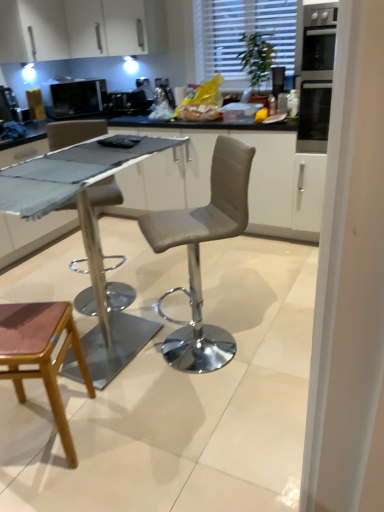
Question: From the image's perspective, would you say white textured blinds at upper center is positioned over white glossy cabinet at upper left?

Choices:
 (A) yes
 (B) no

Answer: (B)

Question: From a real-world perspective, is white textured blinds at upper center on top of white glossy cabinet at upper left?

Choices:
 (A) yes
 (B) no

Answer: (B)

Question: From a real-world perspective, is white textured blinds at upper center under white glossy cabinet at upper left?

Choices:
 (A) no
 (B) yes

Answer: (B)

Question: Could you tell me if white textured blinds at upper center is turned towards white glossy cabinet at upper left?

Choices:
 (A) yes
 (B) no

Answer: (B)

Question: Does white textured blinds at upper center have a smaller size compared to white glossy cabinet at upper left?

Choices:
 (A) yes
 (B) no

Answer: (A)

Question: Is white textured blinds at upper center bigger or smaller than black glass oven at upper right?

Choices:
 (A) small
 (B) big

Answer: (A)

Question: Is white textured blinds at upper center to the left or to the right of black glass oven at upper right in the image?

Choices:
 (A) right
 (B) left

Answer: (B)

Question: Is white textured blinds at upper center in front of or behind black glass oven at upper right in the image?

Choices:
 (A) front
 (B) behind

Answer: (B)

Question: Is point (236, 81) positioned closer to the camera than point (301, 117)?

Choices:
 (A) closer
 (B) farther

Answer: (B)

Question: Considering the positions of matte black microwave at upper left, placed as the second appliance when sorted from right to left, and black glass oven at upper right in the image, is matte black microwave at upper left, placed as the second appliance when sorted from right to left, wider or thinner than black glass oven at upper right?

Choices:
 (A) wide
 (B) thin

Answer: (B)

Question: Is matte black microwave at upper left, the 1th appliance in the left-to-right sequence, bigger or smaller than black glass oven at upper right?

Choices:
 (A) big
 (B) small

Answer: (B)

Question: From the image's perspective, relative to black glass oven at upper right, is matte black microwave at upper left, the 1th appliance in the left-to-right sequence, above or below?

Choices:
 (A) below
 (B) above

Answer: (B)

Question: Is point (102, 97) positioned closer to the camera than point (314, 137)?

Choices:
 (A) closer
 (B) farther

Answer: (B)

Question: From the image's perspective, is pink leather stool at lower left located above or below black glass oven at upper right?

Choices:
 (A) above
 (B) below

Answer: (B)

Question: From a real-world perspective, relative to black glass oven at upper right, is pink leather stool at lower left vertically above or below?

Choices:
 (A) above
 (B) below

Answer: (B)